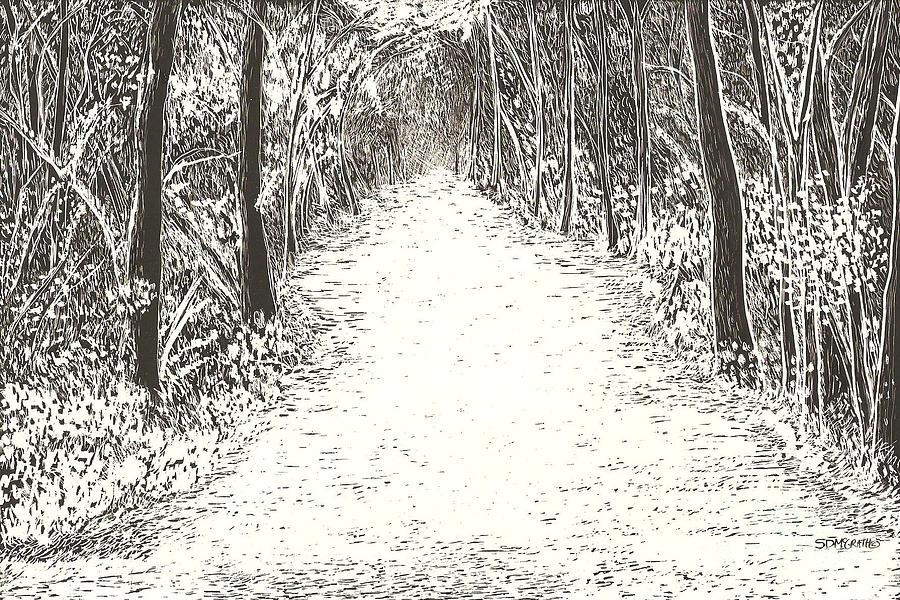
I want to click on canopy, so click(x=425, y=5).